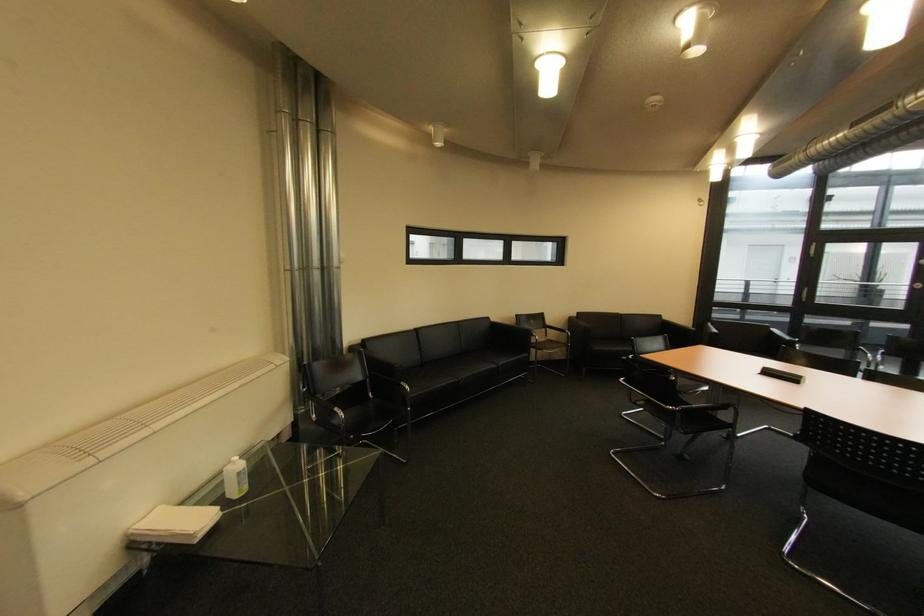
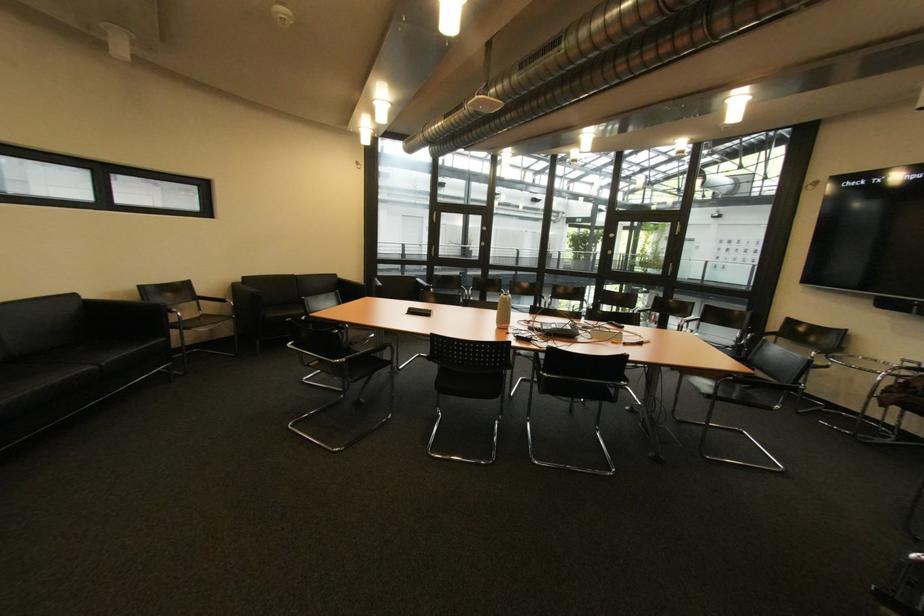
Question: The camera is either moving clockwise (left) or counter-clockwise (right) around the object. The first image is from the beginning of the video and the second image is from the end. Is the camera moving left or right when shooting the video?

Choices:
 (A) Left
 (B) Right

Answer: (A)